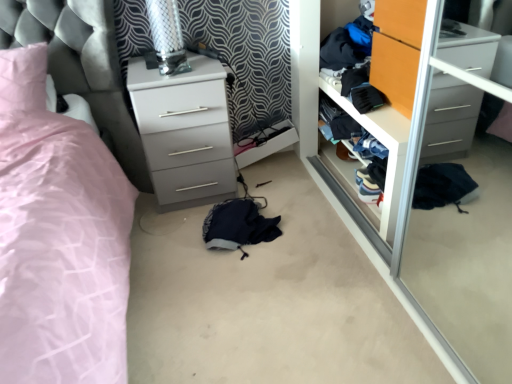
Locate an element on the screen. orange wood wardrobe at center is located at coordinates (397, 50).

Find the location of a particular element. This screenshot has height=384, width=512. white glossy chest of drawers at center is located at coordinates (184, 130).

What do you see at coordinates (184, 130) in the screenshot?
I see `white glossy chest of drawers at center` at bounding box center [184, 130].

Where is `wooden closet door at center`? This screenshot has height=384, width=512. wooden closet door at center is located at coordinates (348, 179).

Which object is closer to the camera taking this photo, navy blue fabric at center or orange wood wardrobe at center?

orange wood wardrobe at center is more forward.

Which of these two, navy blue fabric at center or orange wood wardrobe at center, is smaller?

With smaller size is orange wood wardrobe at center.

I want to click on armoire located on the right of navy blue fabric at center, so click(x=397, y=50).

From the image's perspective, which object appears higher, navy blue fabric at center or orange wood wardrobe at center?

orange wood wardrobe at center, from the image's perspective.

From the picture: How many degrees apart are the facing directions of navy blue fabric at center and white glossy chest of drawers at center?

The angular difference between navy blue fabric at center and white glossy chest of drawers at center is 0.000192 degrees.

Is navy blue fabric at center to the left of white glossy chest of drawers at center from the viewer's perspective?

No.

Does navy blue fabric at center have a smaller size compared to white glossy chest of drawers at center?

Yes.

Is the position of navy blue fabric at center less distant than that of white glossy chest of drawers at center?

Yes, it is in front of white glossy chest of drawers at center.

Between wooden closet door at center and navy blue fabric at center, which one has smaller width?

wooden closet door at center is thinner.

Which object is further away from the camera taking this photo, wooden closet door at center or navy blue fabric at center?

navy blue fabric at center is behind.

How many degrees apart are the facing directions of wooden closet door at center and navy blue fabric at center?

There is a 90.4-degree angle between the facing directions of wooden closet door at center and navy blue fabric at center.

Can we say orange wood wardrobe at center lies outside white glossy chest of drawers at center?

Yes, orange wood wardrobe at center is not within white glossy chest of drawers at center.

Can you confirm if orange wood wardrobe at center is taller than white glossy chest of drawers at center?

Incorrect, the height of orange wood wardrobe at center is not larger of that of white glossy chest of drawers at center.

Looking at this image, can you tell me how much orange wood wardrobe at center and white glossy chest of drawers at center differ in facing direction?

88.5 degrees separate the facing orientations of orange wood wardrobe at center and white glossy chest of drawers at center.

Is orange wood wardrobe at center turned away from white glossy chest of drawers at center?

No, orange wood wardrobe at center is not facing the opposite direction of white glossy chest of drawers at center.

Between wooden closet door at center and orange wood wardrobe at center, which one has more height?

wooden closet door at center is taller.

Which object is thinner, wooden closet door at center or orange wood wardrobe at center?

Thinner between the two is orange wood wardrobe at center.

From a real-world perspective, which is physically below, wooden closet door at center or orange wood wardrobe at center?

In real-world perspective, wooden closet door at center is lower.

Is wooden closet door at center in front of or behind orange wood wardrobe at center in the image?

Clearly, wooden closet door at center is behind orange wood wardrobe at center.

Which is behind, wooden closet door at center or white glossy chest of drawers at center?

white glossy chest of drawers at center is further from the camera.

From the picture: From the image's perspective, which is above, wooden closet door at center or white glossy chest of drawers at center?

white glossy chest of drawers at center.

Which of these two, wooden closet door at center or white glossy chest of drawers at center, is bigger?

Bigger between the two is white glossy chest of drawers at center.

From a real-world perspective, is wooden closet door at center on white glossy chest of drawers at center?

Incorrect, from a real-world perspective, wooden closet door at center is lower than white glossy chest of drawers at center.

In terms of size, does navy blue fabric at center appear bigger or smaller than wooden closet door at center?

Considering their sizes, navy blue fabric at center takes up less space than wooden closet door at center.

Is navy blue fabric at center next to wooden closet door at center and touching it?

They are not placed beside each other.

From a real-world perspective, which is physically below, navy blue fabric at center or wooden closet door at center?

navy blue fabric at center.

The image size is (512, 384). In the image, there is a orange wood wardrobe at center. Identify the location of clothing below it (from the image's perspective). (238, 225).

Find the location of a particular element. clothing lying on the right of white glossy chest of drawers at center is located at coordinates (238, 225).

When comparing their distances from navy blue fabric at center, does wooden closet door at center or orange wood wardrobe at center seem closer?

The object closer to navy blue fabric at center is wooden closet door at center.

Looking at the image, which one is located further to wooden closet door at center, white glossy chest of drawers at center or orange wood wardrobe at center?

white glossy chest of drawers at center lies further to wooden closet door at center than the other object.

From the image, which object appears to be farther from wooden closet door at center, navy blue fabric at center or orange wood wardrobe at center?

navy blue fabric at center.

When comparing their distances from orange wood wardrobe at center, does navy blue fabric at center or wooden closet door at center seem further?

navy blue fabric at center lies further to orange wood wardrobe at center than the other object.

Based on their spatial positions, is white glossy chest of drawers at center or wooden closet door at center closer to orange wood wardrobe at center?

wooden closet door at center.

Estimate the real-world distances between objects in this image. Which object is closer to white glossy chest of drawers at center, navy blue fabric at center or orange wood wardrobe at center?

navy blue fabric at center lies closer to white glossy chest of drawers at center than the other object.

Looking at the image, which one is located closer to orange wood wardrobe at center, wooden closet door at center or navy blue fabric at center?

wooden closet door at center is closer to orange wood wardrobe at center.

Which object lies nearer to the anchor point navy blue fabric at center, white glossy chest of drawers at center or orange wood wardrobe at center?

white glossy chest of drawers at center is positioned closer to the anchor navy blue fabric at center.

Where is `shelf between navy blue fabric at center and orange wood wardrobe at center in the horizontal direction`? This screenshot has height=384, width=512. shelf between navy blue fabric at center and orange wood wardrobe at center in the horizontal direction is located at coordinates (348, 179).

Locate an element on the screen. clothing situated between white glossy chest of drawers at center and wooden closet door at center from left to right is located at coordinates (238, 225).

Identify the location of clothing between white glossy chest of drawers at center and orange wood wardrobe at center from left to right. Image resolution: width=512 pixels, height=384 pixels. (238, 225).

This screenshot has width=512, height=384. I want to click on shelf between white glossy chest of drawers at center and orange wood wardrobe at center from left to right, so (x=348, y=179).